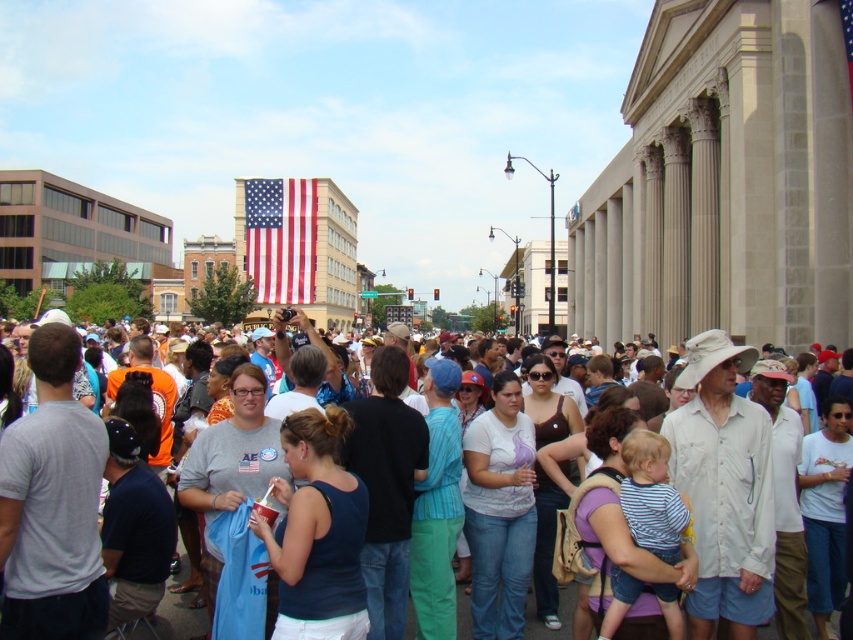
Who is positioned more to the right, white cotton shirt at center or american flag at upper center?

american flag at upper center

Between point (173, 621) and point (846, 64), which one is positioned in front?

Positioned in front is point (173, 621).

Where is `white cotton shirt at center`? white cotton shirt at center is located at coordinates tap(178, 618).

Is red-white-and-blue fabric flag at upper center wider than white cotton shirt at center?

In fact, red-white-and-blue fabric flag at upper center might be narrower than white cotton shirt at center.

Is point (260, 230) farther from camera compared to point (566, 598)?

Yes, it is behind point (566, 598).

Is point (270, 204) more distant than point (167, 596)?

Yes.

The height and width of the screenshot is (640, 853). What are the coordinates of `red-white-and-blue fabric flag at upper center` in the screenshot? It's located at tap(280, 237).

Who is positioned more to the right, red-white-and-blue fabric flag at upper center or american flag at upper center?

american flag at upper center

At what (x,y) coordinates should I click in order to perform the action: click on red-white-and-blue fabric flag at upper center. Please return your answer as a coordinate pair (x, y). The image size is (853, 640). Looking at the image, I should click on (280, 237).

Locate an element on the screen. The image size is (853, 640). red-white-and-blue fabric flag at upper center is located at coordinates (280, 237).

Locate an element on the screen. The width and height of the screenshot is (853, 640). red-white-and-blue fabric flag at upper center is located at coordinates (280, 237).